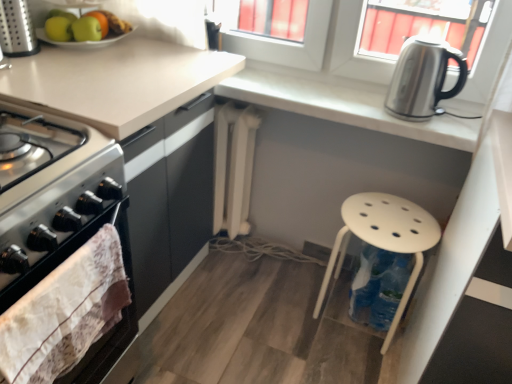
What are the coordinates of `spots to the right of green matte apple at upper left, acting as the third apple starting from the right` in the screenshot? It's located at (119, 48).